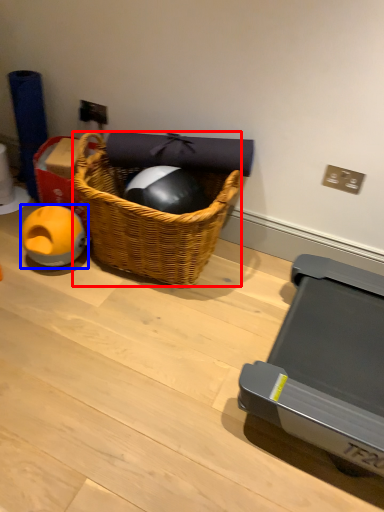
Question: Which object appears closest to the camera in this image, picnic basket (highlighted by a red box) or toy (highlighted by a blue box)?

Choices:
 (A) picnic basket
 (B) toy

Answer: (A)